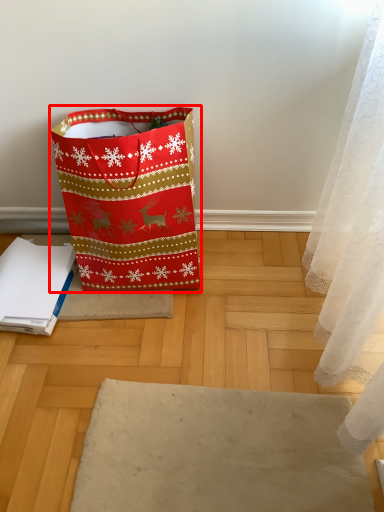
Question: From the image's perspective, what is the correct spatial relationship of luggage and bags (annotated by the red box) in relation to notebook?

Choices:
 (A) above
 (B) below

Answer: (A)